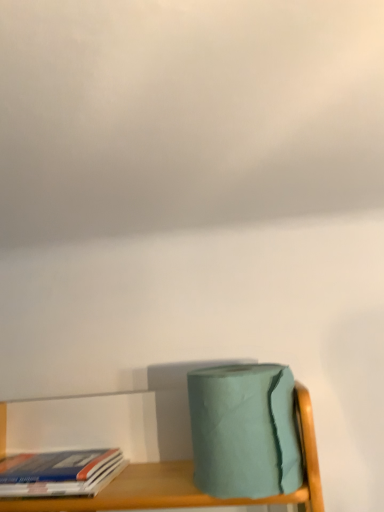
Question: Does cloudy white sky at upper center turn towards hardcover book at lower left?

Choices:
 (A) no
 (B) yes

Answer: (A)

Question: From a real-world perspective, is cloudy white sky at upper center located beneath hardcover book at lower left?

Choices:
 (A) no
 (B) yes

Answer: (A)

Question: From a real-world perspective, does cloudy white sky at upper center stand above hardcover book at lower left?

Choices:
 (A) no
 (B) yes

Answer: (B)

Question: Is cloudy white sky at upper center next to hardcover book at lower left and touching it?

Choices:
 (A) no
 (B) yes

Answer: (A)

Question: Can you confirm if cloudy white sky at upper center is positioned to the left of hardcover book at lower left?

Choices:
 (A) yes
 (B) no

Answer: (B)

Question: Is cloudy white sky at upper center further to the viewer compared to hardcover book at lower left?

Choices:
 (A) yes
 (B) no

Answer: (B)

Question: Is teal matte toilet paper at lower right facing towards cloudy white sky at upper center?

Choices:
 (A) yes
 (B) no

Answer: (B)

Question: From a real-world perspective, is teal matte toilet paper at lower right located higher than cloudy white sky at upper center?

Choices:
 (A) yes
 (B) no

Answer: (B)

Question: Is teal matte toilet paper at lower right not inside cloudy white sky at upper center?

Choices:
 (A) yes
 (B) no

Answer: (A)

Question: Is teal matte toilet paper at lower right to the left of cloudy white sky at upper center from the viewer's perspective?

Choices:
 (A) yes
 (B) no

Answer: (B)

Question: Considering the relative sizes of teal matte toilet paper at lower right and cloudy white sky at upper center in the image provided, is teal matte toilet paper at lower right bigger than cloudy white sky at upper center?

Choices:
 (A) yes
 (B) no

Answer: (B)

Question: Is the depth of teal matte toilet paper at lower right less than that of cloudy white sky at upper center?

Choices:
 (A) yes
 (B) no

Answer: (B)

Question: Is teal matte toilet paper at lower right positioned with its back to hardcover book at lower left?

Choices:
 (A) yes
 (B) no

Answer: (B)